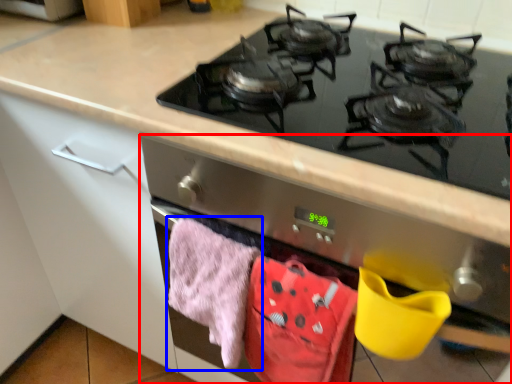
Question: Which object is closer to the camera taking this photo, oven (highlighted by a red box) or beach towel (highlighted by a blue box)?

Choices:
 (A) oven
 (B) beach towel

Answer: (A)